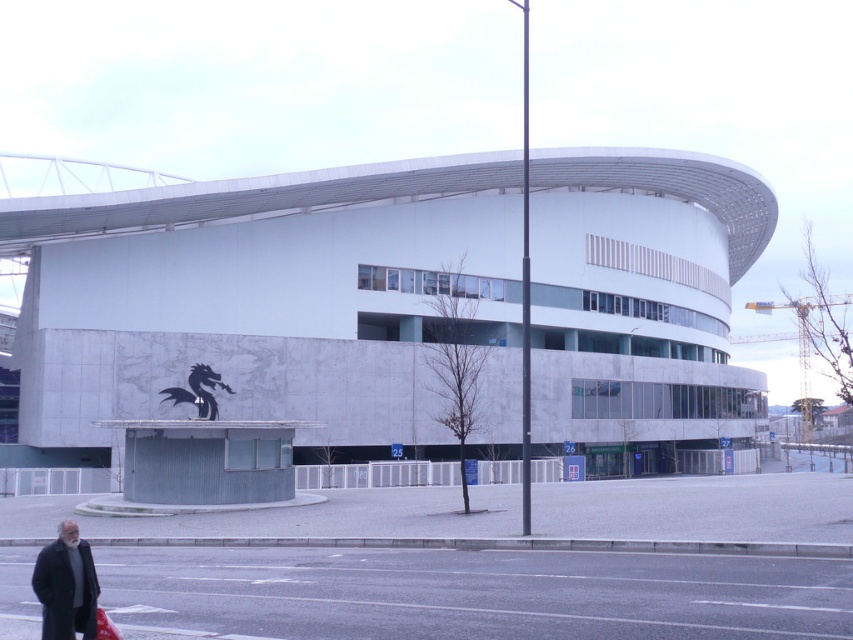
Who is taller, white marble stadium at center or dark gray wool coat at lower left?

With more height is white marble stadium at center.

Is point (247, 280) positioned after point (74, 544)?

Yes, point (247, 280) is farther from viewer.

Between point (618, 166) and point (83, 598), which one is positioned in front?

Positioned in front is point (83, 598).

The height and width of the screenshot is (640, 853). I want to click on white marble stadium at center, so click(x=270, y=304).